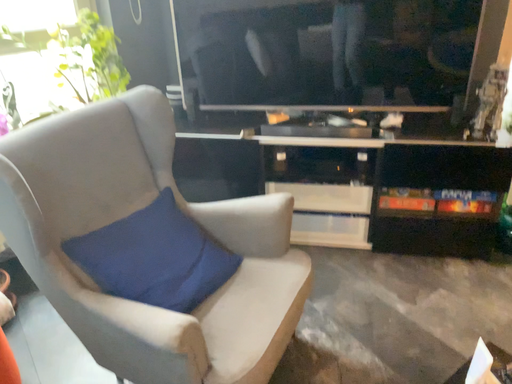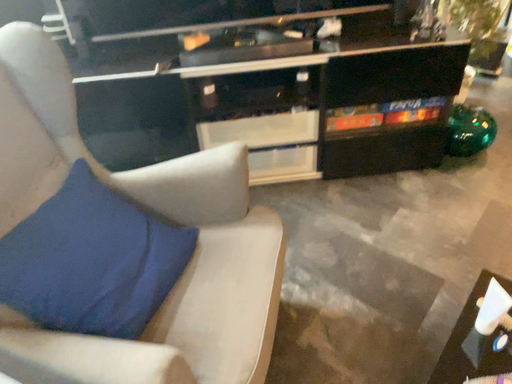
Question: Which way did the camera rotate in the video?

Choices:
 (A) rotated upward
 (B) rotated downward

Answer: (B)